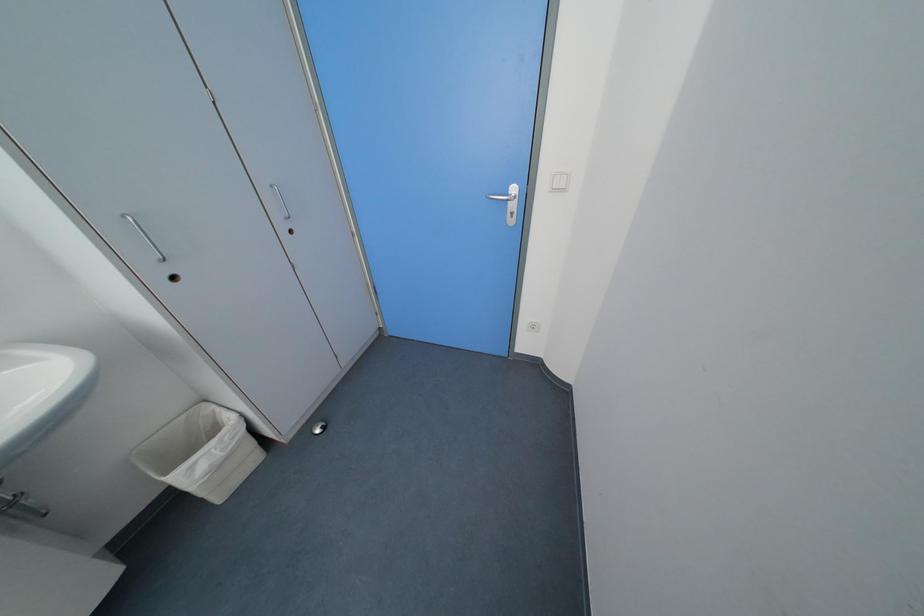
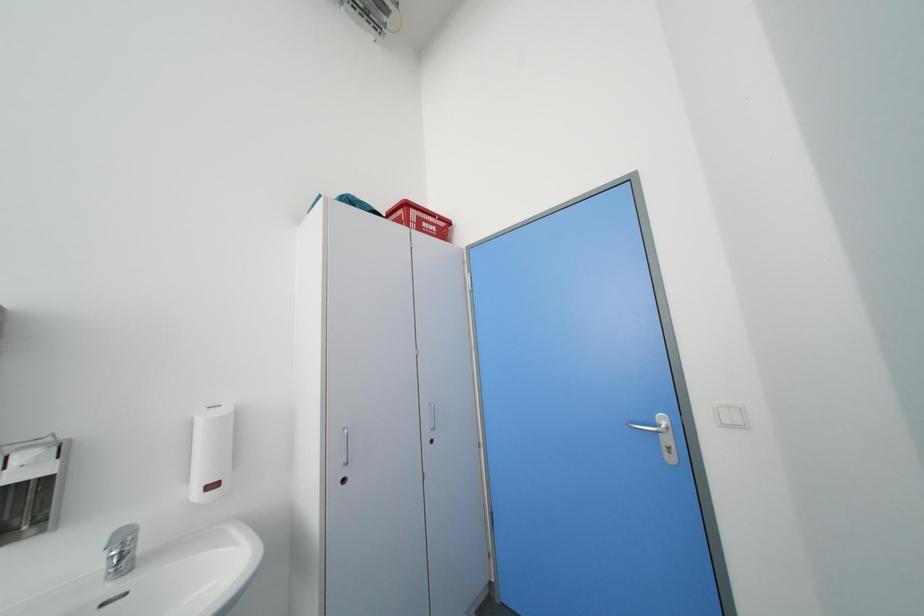
Consider the image. How did the camera likely rotate?

The rotation direction of the camera is left-up.